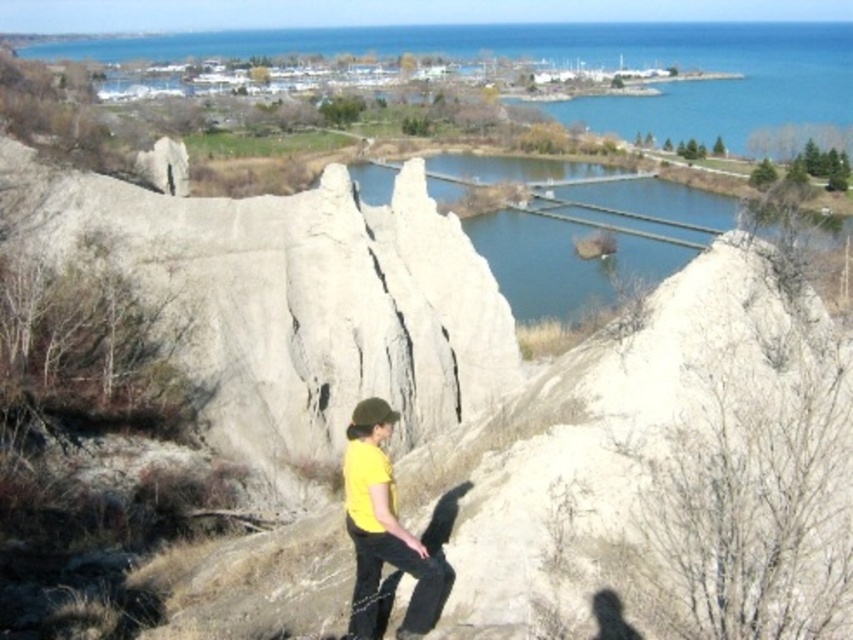
Does point (341, 632) lie in front of point (711, 209)?

Yes, point (341, 632) is closer to viewer.

Between white sandy cliff at center and greenish-blue water at center, which one appears on the left side from the viewer's perspective?

white sandy cliff at center is more to the left.

Between point (579, 509) and point (688, 202), which one is positioned in front?

Positioned in front is point (579, 509).

Locate an element on the screen. Image resolution: width=853 pixels, height=640 pixels. white sandy cliff at center is located at coordinates (657, 472).

Is point (192, 362) behind point (374, 554)?

That is True.

Image resolution: width=853 pixels, height=640 pixels. Describe the element at coordinates (291, 301) in the screenshot. I see `white rough rock at center` at that location.

This screenshot has width=853, height=640. I want to click on white rough rock at center, so click(x=291, y=301).

In the scene shown: Does white sandy cliff at center have a greater width compared to white rough rock at center?

Incorrect, white sandy cliff at center's width does not surpass white rough rock at center's.

Can you confirm if white sandy cliff at center is positioned below white rough rock at center?

Correct, white sandy cliff at center is located below white rough rock at center.

The image size is (853, 640). What are the coordinates of `white sandy cliff at center` in the screenshot? It's located at (657, 472).

In order to click on white sandy cliff at center in this screenshot , I will do `click(657, 472)`.